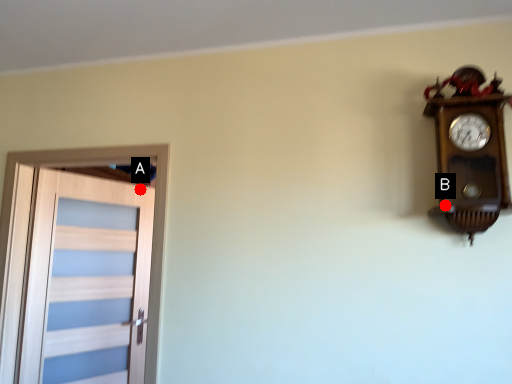
Question: Two points are circled on the image, labeled by A and B beside each circle. Which of the following is the farthest from the observer?

Choices:
 (A) A is further
 (B) B is further

Answer: (A)